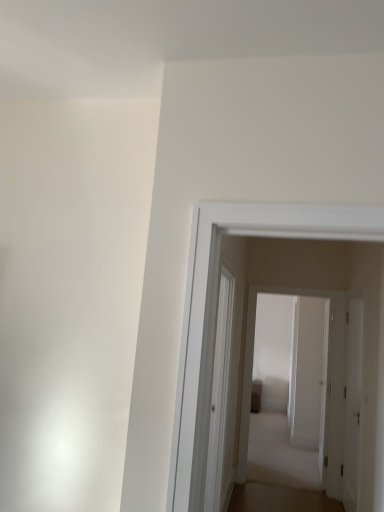
At what (x,y) coordinates should I click in order to perform the action: click on white matte door at right, which is the first door from front to back. Please return your answer as a coordinate pair (x, y). The width and height of the screenshot is (384, 512). Looking at the image, I should click on (352, 403).

The width and height of the screenshot is (384, 512). In order to click on white glossy door at center, which appears as the 1th door when viewed from the back in this screenshot , I will do `click(324, 383)`.

From a real-world perspective, is white glossy door at center, which appears as the 1th door when viewed from the back, positioned above or below transparent glass door at center?

white glossy door at center, which appears as the 1th door when viewed from the back, is situated lower than transparent glass door at center in the real world.

Is white glossy door at center, acting as the 2th door starting from the front, not within transparent glass door at center?

Yes, white glossy door at center, acting as the 2th door starting from the front, is outside of transparent glass door at center.

Relative to transparent glass door at center, is white glossy door at center, acting as the 2th door starting from the front, in front or behind?

white glossy door at center, acting as the 2th door starting from the front, is positioned farther from the viewer than transparent glass door at center.

Is white glossy door at center, which appears as the 1th door when viewed from the back, oriented towards transparent glass door at center?

Yes, white glossy door at center, which appears as the 1th door when viewed from the back, is oriented towards transparent glass door at center.

Does transparent glass door at center turn towards white matte door at right, which is the first door from front to back?

No.

Does transparent glass door at center touch white matte door at right, which is the first door from front to back?

No, transparent glass door at center is not next to white matte door at right, which is the first door from front to back.

This screenshot has height=512, width=384. There is a white matte door at right, positioned as the 2th door in back-to-front order. What are the coordinates of `glass door above it (from a real-world perspective)` in the screenshot? It's located at (220, 392).

Based on their positions, is transparent glass door at center located to the left or right of white matte door at right, positioned as the 2th door in back-to-front order?

transparent glass door at center is positioned on white matte door at right, positioned as the 2th door in back-to-front order,'s left side.

Considering the relative sizes of transparent glass door at center and white glossy door at center, acting as the 2th door starting from the front, in the image provided, is transparent glass door at center wider than white glossy door at center, acting as the 2th door starting from the front,?

Yes, transparent glass door at center is wider than white glossy door at center, acting as the 2th door starting from the front.

Is transparent glass door at center at the left side of white glossy door at center, which appears as the 1th door when viewed from the back?

Yes, transparent glass door at center is to the left of white glossy door at center, which appears as the 1th door when viewed from the back.

Does transparent glass door at center contain white glossy door at center, which appears as the 1th door when viewed from the back?

No, white glossy door at center, which appears as the 1th door when viewed from the back, is not inside transparent glass door at center.

Is white glossy door at center, acting as the 2th door starting from the front, a part of white matte door at right, positioned as the 2th door in back-to-front order?

No, white glossy door at center, acting as the 2th door starting from the front, is not a part of white matte door at right, positioned as the 2th door in back-to-front order.

From a real-world perspective, is white matte door at right, which is the first door from front to back, above or below white glossy door at center, which appears as the 1th door when viewed from the back?

white matte door at right, which is the first door from front to back, is below white glossy door at center, which appears as the 1th door when viewed from the back.

Does point (346, 315) lie in front of point (342, 398)?

That is False.

How far apart are white matte door at right, which is the first door from front to back, and white glossy door at center, acting as the 2th door starting from the front?

21.08 inches.

Starting from the transparent glass door at center, which door is the 1st one behind? Please provide its 2D coordinates.

[(352, 403)]

Is white matte door at right, which is the first door from front to back, thinner than transparent glass door at center?

Yes.

Who is taller, white matte door at right, which is the first door from front to back, or transparent glass door at center?

Standing taller between the two is white matte door at right, which is the first door from front to back.

Is white matte door at right, which is the first door from front to back, situated inside transparent glass door at center or outside?

white matte door at right, which is the first door from front to back, is located beyond the bounds of transparent glass door at center.

Is white glossy door at center, which appears as the 1th door when viewed from the back, behind white matte door at right, which is the first door from front to back?

Yes, it is behind white matte door at right, which is the first door from front to back.

Identify the location of door located in front of the white glossy door at center, which appears as the 1th door when viewed from the back. (352, 403).

From the image's perspective, is white glossy door at center, which appears as the 1th door when viewed from the back, over white matte door at right, which is the first door from front to back?

Yes, from the image's perspective, white glossy door at center, which appears as the 1th door when viewed from the back, is on top of white matte door at right, which is the first door from front to back.

I want to click on glass door located above the white glossy door at center, acting as the 2th door starting from the front (from the image's perspective), so click(x=220, y=392).

Image resolution: width=384 pixels, height=512 pixels. What are the coordinates of `door that is the 2nd object located below the transparent glass door at center (from the image's perspective)` in the screenshot? It's located at (352, 403).

From the image, which object appears to be nearer to transparent glass door at center, white matte door at right, which is the first door from front to back, or white glossy door at center, which appears as the 1th door when viewed from the back?

white matte door at right, which is the first door from front to back, is positioned closer to the anchor transparent glass door at center.

From the image, which object appears to be nearer to white glossy door at center, acting as the 2th door starting from the front, transparent glass door at center or white matte door at right, which is the first door from front to back?

white matte door at right, which is the first door from front to back, is positioned closer to the anchor white glossy door at center, acting as the 2th door starting from the front.

Based on their spatial positions, is white matte door at right, positioned as the 2th door in back-to-front order, or transparent glass door at center further from white glossy door at center, acting as the 2th door starting from the front?

Based on the image, transparent glass door at center appears to be further to white glossy door at center, acting as the 2th door starting from the front.

Looking at the image, which one is located further to white matte door at right, positioned as the 2th door in back-to-front order, transparent glass door at center or white glossy door at center, which appears as the 1th door when viewed from the back?

transparent glass door at center.

Based on their spatial positions, is white glossy door at center, acting as the 2th door starting from the front, or transparent glass door at center closer to white matte door at right, positioned as the 2th door in back-to-front order?

white glossy door at center, acting as the 2th door starting from the front, is positioned closer to the anchor white matte door at right, positioned as the 2th door in back-to-front order.

Based on their spatial positions, is white glossy door at center, which appears as the 1th door when viewed from the back, or white matte door at right, positioned as the 2th door in back-to-front order, further from transparent glass door at center?

Based on the image, white glossy door at center, which appears as the 1th door when viewed from the back, appears to be further to transparent glass door at center.

You are a GUI agent. You are given a task and a screenshot of the screen. Output one action in this format:
    pyautogui.click(x=<x>, y=<y>)
    Task: Click on the door positioned between transparent glass door at center and white glossy door at center, acting as the 2th door starting from the front, from near to far
    This screenshot has height=512, width=384.
    Given the screenshot: What is the action you would take?
    pyautogui.click(x=352, y=403)